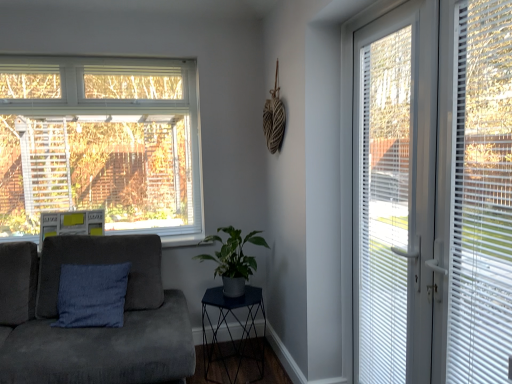
Identify the location of green matte plant at center. (233, 259).

I want to click on white plastic blinds at right, so click(x=481, y=196).

Describe the element at coordinates (102, 264) in the screenshot. This screenshot has height=384, width=512. I see `blue fabric cushion at left` at that location.

Image resolution: width=512 pixels, height=384 pixels. What do you see at coordinates (433, 194) in the screenshot? I see `white plastic door at right` at bounding box center [433, 194].

Image resolution: width=512 pixels, height=384 pixels. I want to click on green matte plant at center, so click(233, 259).

Is metallic dark blue side table at center taller or shorter than white plastic blinds at right?

Clearly, metallic dark blue side table at center is shorter compared to white plastic blinds at right.

Relative to white plastic blinds at right, is metallic dark blue side table at center in front or behind?

Visually, metallic dark blue side table at center is located behind white plastic blinds at right.

From the image's perspective, is metallic dark blue side table at center located above white plastic blinds at right?

No.

Which is in front, point (126, 318) or point (478, 93)?

Point (478, 93)

Are suede couch at left and white plastic blinds at right beside each other?

suede couch at left and white plastic blinds at right are clearly separated.

Which of these two, suede couch at left or white plastic blinds at right, is thinner?

Thinner between the two is white plastic blinds at right.

From a real-world perspective, is suede couch at left on white plastic blinds at right?

No, from a real-world perspective, suede couch at left is not over white plastic blinds at right

Is white plastic blinds at right thinner than white plastic blinds at right?

Yes, white plastic blinds at right is thinner than white plastic blinds at right.

Is the depth of white plastic blinds at right greater than that of white plastic blinds at right?

Yes, white plastic blinds at right is behind white plastic blinds at right.

From a real-world perspective, is white plastic blinds at right positioned over white plastic blinds at right based on gravity?

No, from a real-world perspective, white plastic blinds at right is not over white plastic blinds at right

Is white plastic blinds at right placed right next to white plastic blinds at right?

No, white plastic blinds at right is not next to white plastic blinds at right.

From the image's perspective, between white plastic door at right and white plastic blinds at right, which one is located above?

white plastic door at right is shown above in the image.

Is white plastic blinds at right located within white plastic door at right?

Yes.

Is white plastic door at right placed right next to white plastic blinds at right?

They are not placed beside each other.

From a real-world perspective, is metallic dark blue side table at center physically below white plastic blinds at right?

Correct, in the physical world, metallic dark blue side table at center is lower than white plastic blinds at right.

Can you confirm if metallic dark blue side table at center is wider than white plastic blinds at right?

Indeed, metallic dark blue side table at center has a greater width compared to white plastic blinds at right.

Which object is closer to the camera taking this photo, metallic dark blue side table at center or white plastic blinds at right?

white plastic blinds at right is in front.

Considering the sizes of objects metallic dark blue side table at center and white plastic blinds at right in the image provided, who is taller, metallic dark blue side table at center or white plastic blinds at right?

Standing taller between the two is white plastic blinds at right.

From a real-world perspective, between blue fabric cushion at left and metallic dark blue side table at center, who is vertically lower?

From a 3D spatial view, metallic dark blue side table at center is below.

Is point (91, 257) behind point (233, 346)?

No, it is not.

Can you confirm if blue fabric cushion at left is wider than metallic dark blue side table at center?

No.

Is blue fabric cushion at left far from metallic dark blue side table at center?

No, blue fabric cushion at left is not far away from metallic dark blue side table at center.

From a real-world perspective, is white plastic blinds at right below metallic dark blue side table at center?

No, from a real-world perspective, white plastic blinds at right is not under metallic dark blue side table at center.

Can you confirm if white plastic blinds at right is shorter than metallic dark blue side table at center?

No, white plastic blinds at right is not shorter than metallic dark blue side table at center.

Considering the sizes of objects white plastic blinds at right and metallic dark blue side table at center in the image provided, who is wider, white plastic blinds at right or metallic dark blue side table at center?

Wider between the two is metallic dark blue side table at center.

Which point is more forward, (x=372, y=116) or (x=233, y=381)?

The point (x=372, y=116) is closer.

Where is `table behind the white plastic blinds at right`? table behind the white plastic blinds at right is located at coordinates (229, 329).

Locate an element on the screen. This screenshot has width=512, height=384. window blind in front of the suede couch at left is located at coordinates (481, 196).

Which object lies nearer to the anchor point metallic dark blue side table at center, white plastic blinds at right or suede couch at left?

suede couch at left lies closer to metallic dark blue side table at center than the other object.

Based on their spatial positions, is white plastic door at right or white plastic blinds at right further from white plastic blinds at right?

Based on the image, white plastic blinds at right appears to be further to white plastic blinds at right.

Based on their spatial positions, is blue fabric cushion at left or white plastic blinds at right closer to green matte plant at center?

blue fabric cushion at left is positioned closer to the anchor green matte plant at center.

Looking at the image, which one is located further to suede couch at left, green matte plant at center or white plastic blinds at right?

Based on the image, white plastic blinds at right appears to be further to suede couch at left.

Which object lies nearer to the anchor point white plastic blinds at right, metallic dark blue side table at center or suede couch at left?

metallic dark blue side table at center.

From the image, which object appears to be nearer to blue fabric cushion at left, white plastic blinds at right or suede couch at left?

suede couch at left lies closer to blue fabric cushion at left than the other object.

When comparing their distances from metallic dark blue side table at center, does white plastic door at right or white plastic blinds at right seem closer?

Among the two, white plastic blinds at right is located nearer to metallic dark blue side table at center.

From the image, which object appears to be farther from white plastic door at right, blue fabric cushion at left or white plastic blinds at right?

blue fabric cushion at left lies further to white plastic door at right than the other object.

Identify the location of table situated between blue fabric cushion at left and green matte plant at center from left to right. This screenshot has height=384, width=512. (229, 329).

Identify the location of table between suede couch at left and green matte plant at center. Image resolution: width=512 pixels, height=384 pixels. (229, 329).

At what (x,y) coordinates should I click in order to perform the action: click on blind between white plastic door at right and metallic dark blue side table at center along the z-axis. Please return your answer as a coordinate pair (x, y). The height and width of the screenshot is (384, 512). Looking at the image, I should click on (384, 206).

I want to click on houseplant situated between suede couch at left and white plastic blinds at right from left to right, so 233,259.